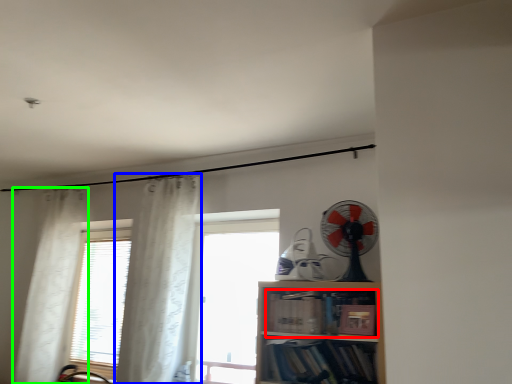
Question: Considering the real-world distances, which object is farthest from book (highlighted by a red box)? curtain (highlighted by a blue box) or curtain (highlighted by a green box)?

Choices:
 (A) curtain
 (B) curtain

Answer: (B)